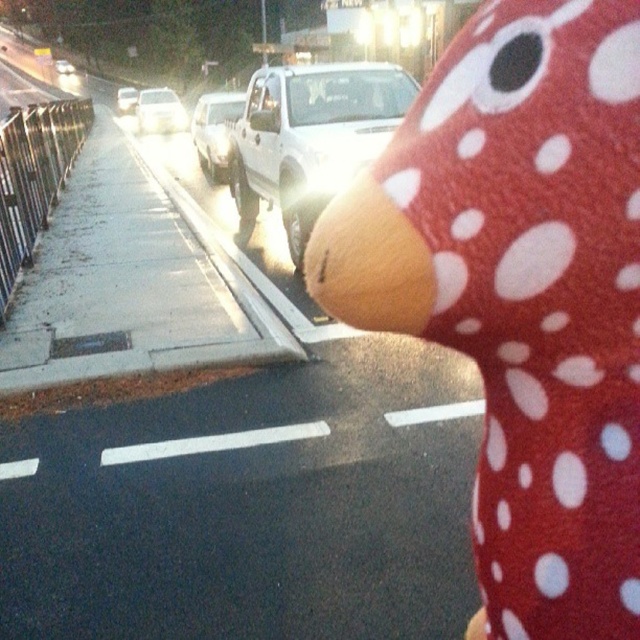
Does white matte truck at center have a greater width compared to metallic silver car at upper center?

Incorrect, white matte truck at center's width does not surpass metallic silver car at upper center's.

Is white matte truck at center thinner than metallic silver car at upper center?

Indeed, white matte truck at center has a lesser width compared to metallic silver car at upper center.

Does point (296, 253) come closer to viewer compared to point (58, 65)?

Yes, it is.

Locate an element on the screen. white matte truck at center is located at coordinates (310, 138).

Is shiny silver suv at center thinner than metallic silver car at upper center?

No, shiny silver suv at center is not thinner than metallic silver car at upper center.

Identify the location of shiny silver suv at center. This screenshot has width=640, height=640. (214, 131).

Does red polka dot plush at right appear on the right side of white glossy car at upper left?

Correct, you'll find red polka dot plush at right to the right of white glossy car at upper left.

Does point (364, 180) come farther from viewer compared to point (164, 99)?

No, it is not.

The image size is (640, 640). I want to click on red polka dot plush at right, so click(x=520, y=294).